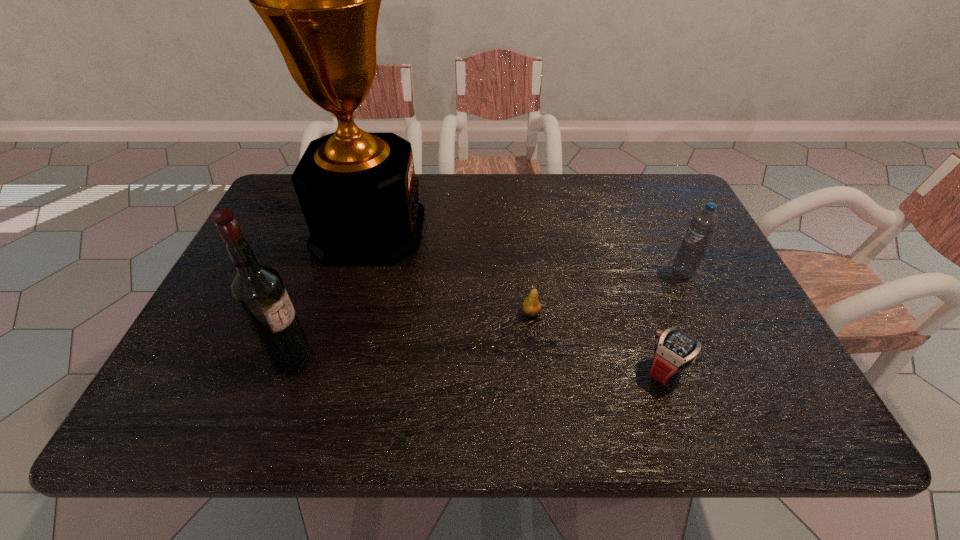
Identify the location of free space at the far right corner. (673, 213).

Locate an element on the screen. The image size is (960, 540). free space between the second object from right to left and the third tallest object is located at coordinates (675, 321).

Where is `vacant space that's between the watch and the trophy cup`? The image size is (960, 540). vacant space that's between the watch and the trophy cup is located at coordinates (518, 300).

Locate an element on the screen. vacant space in between the wine bottle and the trophy cup is located at coordinates (331, 295).

Identify the location of free spot between the third farthest object and the third shortest object. (607, 292).

What are the coordinates of `unoccupied area between the tallest object and the wine bottle` in the screenshot? It's located at (331, 295).

What are the coordinates of `free space that is in between the watch and the third object from left to right` in the screenshot? It's located at (599, 341).

The height and width of the screenshot is (540, 960). Find the location of `free space between the second tallest object and the watch`. free space between the second tallest object and the watch is located at coordinates (480, 364).

This screenshot has width=960, height=540. I want to click on free area in between the third nearest object and the second object from right to left, so click(599, 341).

Where is `empty space that is in between the third farthest object and the watch`? Image resolution: width=960 pixels, height=540 pixels. empty space that is in between the third farthest object and the watch is located at coordinates (599, 341).